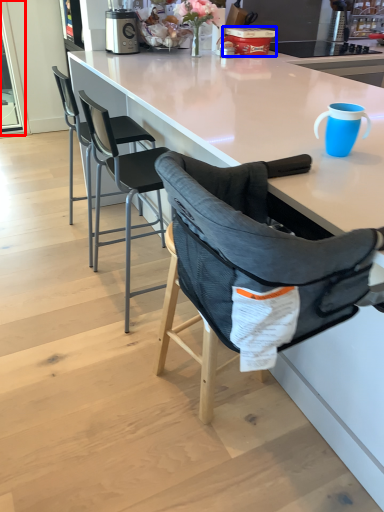
Question: Among these objects, which one is farthest to the camera, screen door (highlighted by a red box) or appliance (highlighted by a blue box)?

Choices:
 (A) screen door
 (B) appliance

Answer: (A)